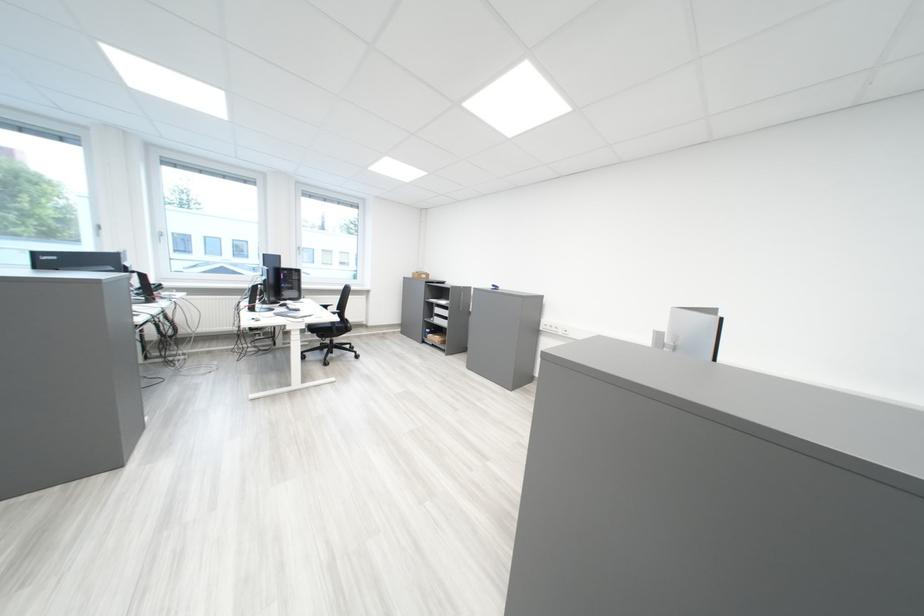
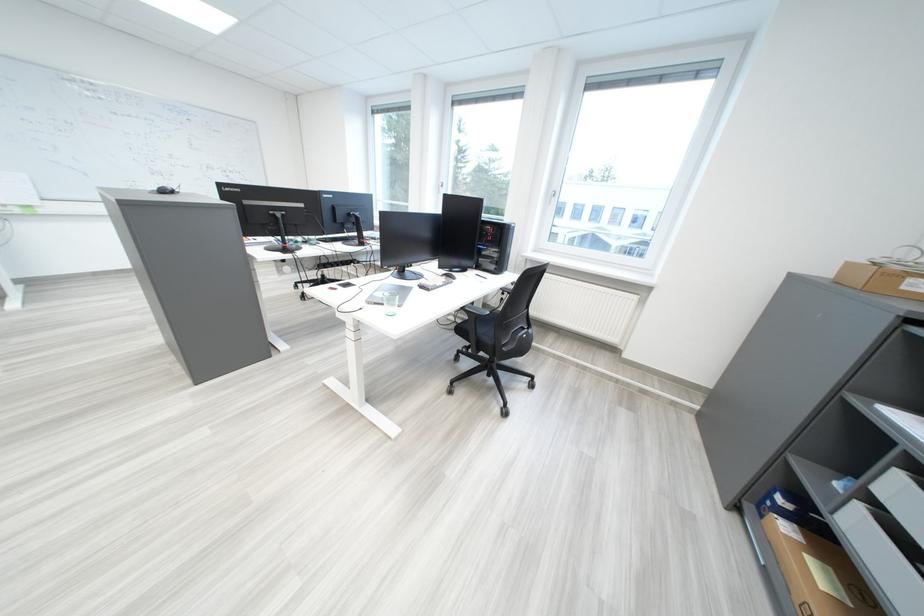
Locate, in the second image, the point that corresponds to point (448, 318) in the first image.

(873, 509)